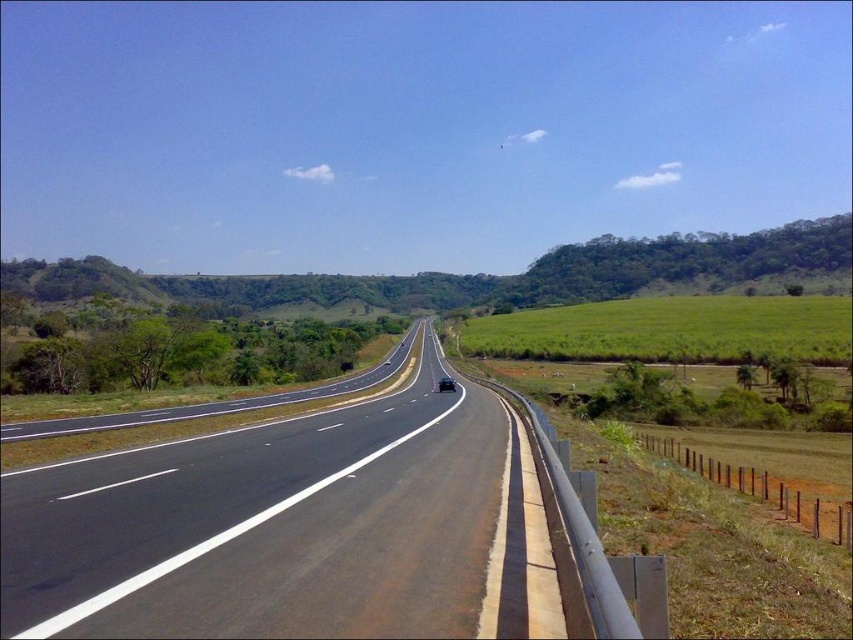
You are a drone operator trying to capture aerial footage of the highway. You have two points marked on your map, point A at coordinates point [485,484] and point B at coordinates point [445,381]. Which point should you prioritize filming first if you want to start from the nearest location to the camera?

Point point [485,484] is closer to the camera than point point [445,381], so you should prioritize filming point point [485,484] first.

You are a driver approaching the black asphalt highway at center and see the shiny black sedan at center ahead. Is the highway above or below the sedan?

The black asphalt highway at center is positioned over the shiny black sedan at center, so the highway is above the sedan.